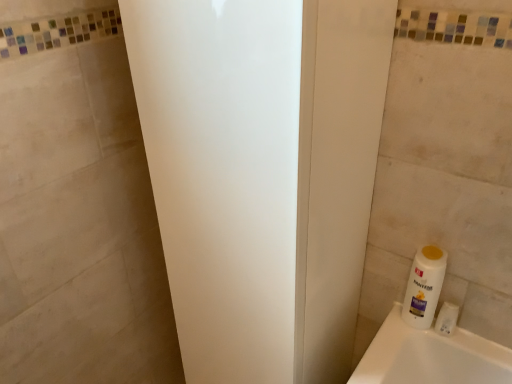
Question: From a real-world perspective, is white plastic bottle at lower right positioned under white matte screen door at center based on gravity?

Choices:
 (A) no
 (B) yes

Answer: (B)

Question: Can you confirm if white plastic bottle at lower right is positioned to the left of white matte screen door at center?

Choices:
 (A) yes
 (B) no

Answer: (B)

Question: Is white plastic bottle at lower right oriented away from white matte screen door at center?

Choices:
 (A) no
 (B) yes

Answer: (A)

Question: Does white plastic bottle at lower right have a lesser height compared to white matte screen door at center?

Choices:
 (A) no
 (B) yes

Answer: (B)

Question: Is the position of white plastic bottle at lower right more distant than that of white matte screen door at center?

Choices:
 (A) no
 (B) yes

Answer: (B)

Question: Considering the positions of white plastic bottle at lower right and white matte screen door at center in the image, is white plastic bottle at lower right taller or shorter than white matte screen door at center?

Choices:
 (A) short
 (B) tall

Answer: (A)

Question: Is white plastic bottle at lower right in front of or behind white matte screen door at center in the image?

Choices:
 (A) behind
 (B) front

Answer: (A)

Question: Is white plastic bottle at lower right to the left or to the right of white matte screen door at center in the image?

Choices:
 (A) right
 (B) left

Answer: (A)

Question: Does point (456, 322) appear closer or farther from the camera than point (224, 34)?

Choices:
 (A) farther
 (B) closer

Answer: (A)

Question: In terms of height, does white matte screen door at center look taller or shorter compared to white plastic bottle at lower right?

Choices:
 (A) short
 (B) tall

Answer: (B)

Question: Is white matte screen door at center in front of or behind white plastic bottle at lower right in the image?

Choices:
 (A) front
 (B) behind

Answer: (A)

Question: From the image's perspective, relative to white plastic bottle at lower right, is white matte screen door at center above or below?

Choices:
 (A) above
 (B) below

Answer: (A)

Question: In terms of width, does white matte screen door at center look wider or thinner when compared to white plastic bottle at lower right?

Choices:
 (A) wide
 (B) thin

Answer: (A)

Question: Is white plastic bottle at lower right wider or thinner than white matte screen door at center?

Choices:
 (A) wide
 (B) thin

Answer: (B)

Question: Relative to white matte screen door at center, is white plastic bottle at lower right in front or behind?

Choices:
 (A) front
 (B) behind

Answer: (B)